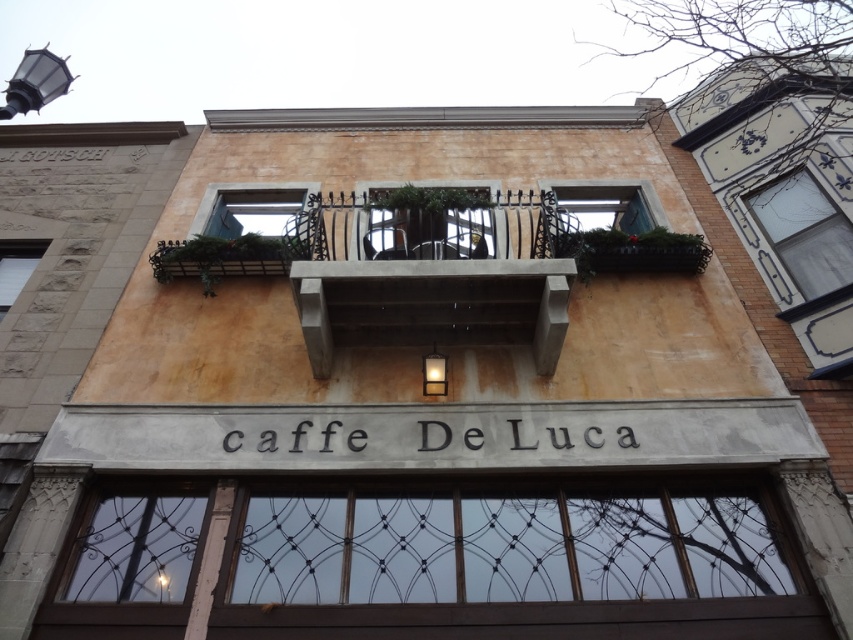
Question: Is brown wooden window at lower center positioned in front of concrete at center?

Choices:
 (A) yes
 (B) no

Answer: (A)

Question: Does brown wooden window at lower center appear on the left side of concrete at center?

Choices:
 (A) yes
 (B) no

Answer: (B)

Question: Which object appears closest to the camera in this image?

Choices:
 (A) brown wooden window at lower center
 (B) concrete at center

Answer: (A)

Question: Which object appears closest to the camera in this image?

Choices:
 (A) brown wooden window at lower center
 (B) concrete at center

Answer: (A)

Question: Does brown wooden window at lower center appear on the left side of concrete at center?

Choices:
 (A) yes
 (B) no

Answer: (B)